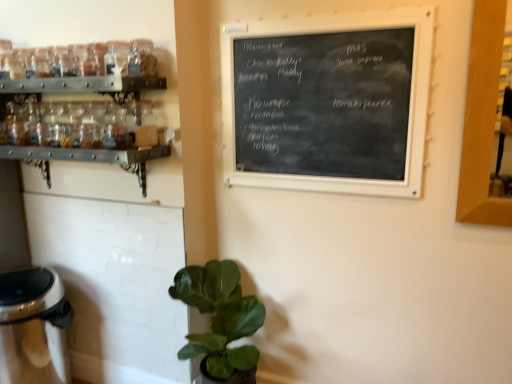
Question: Could you tell me if black chalkboard at upper center is turned towards green matte plant at lower center?

Choices:
 (A) no
 (B) yes

Answer: (A)

Question: Does black chalkboard at upper center lie behind green matte plant at lower center?

Choices:
 (A) no
 (B) yes

Answer: (A)

Question: Is black chalkboard at upper center at the right side of green matte plant at lower center?

Choices:
 (A) yes
 (B) no

Answer: (A)

Question: Can you see black chalkboard at upper center touching green matte plant at lower center?

Choices:
 (A) no
 (B) yes

Answer: (A)

Question: Can you confirm if black chalkboard at upper center is smaller than green matte plant at lower center?

Choices:
 (A) no
 (B) yes

Answer: (B)

Question: From a real-world perspective, is black chalkboard at upper center physically above green matte plant at lower center?

Choices:
 (A) yes
 (B) no

Answer: (A)

Question: Does black chalkboard at upper center appear on the right side of satin silver trash can at lower left?

Choices:
 (A) no
 (B) yes

Answer: (B)

Question: From the image's perspective, is black chalkboard at upper center located beneath satin silver trash can at lower left?

Choices:
 (A) no
 (B) yes

Answer: (A)

Question: Are black chalkboard at upper center and satin silver trash can at lower left far apart?

Choices:
 (A) yes
 (B) no

Answer: (A)

Question: Can you confirm if black chalkboard at upper center is wider than satin silver trash can at lower left?

Choices:
 (A) yes
 (B) no

Answer: (B)

Question: Is black chalkboard at upper center facing towards satin silver trash can at lower left?

Choices:
 (A) yes
 (B) no

Answer: (B)

Question: From a real-world perspective, is black chalkboard at upper center positioned under satin silver trash can at lower left based on gravity?

Choices:
 (A) yes
 (B) no

Answer: (B)

Question: From a real-world perspective, is satin silver trash can at lower left on green matte plant at lower center?

Choices:
 (A) no
 (B) yes

Answer: (A)